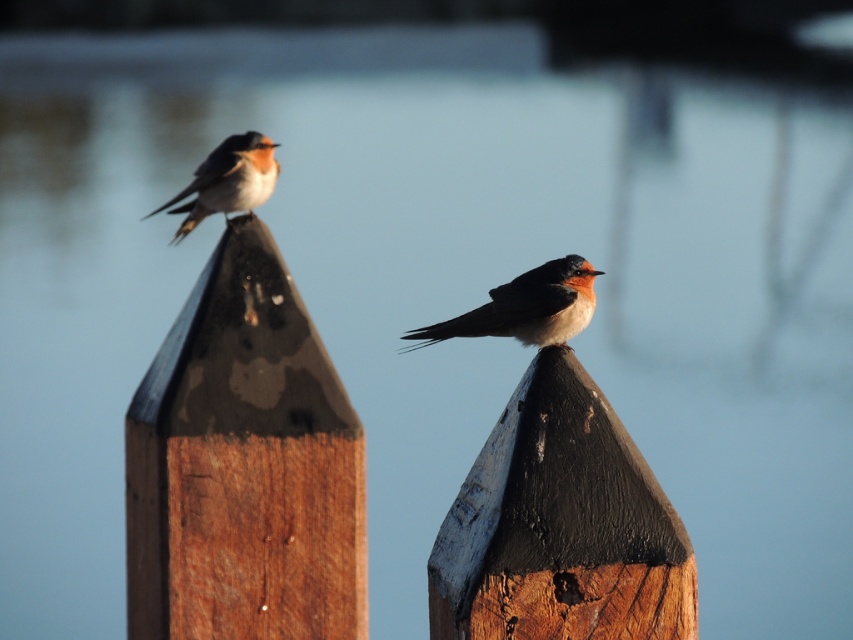
Who is more distant from viewer, (515, 285) or (202, 196)?

Positioned behind is point (202, 196).

Who is lower down, orange-brown feathers at center or bright orange plumage at upper left?

orange-brown feathers at center

What do you see at coordinates (526, 307) in the screenshot? This screenshot has width=853, height=640. I see `orange-brown feathers at center` at bounding box center [526, 307].

I want to click on orange-brown feathers at center, so click(526, 307).

Looking at this image, who is positioned more to the left, painted wood post at center or bright orange plumage at upper left?

Positioned to the left is bright orange plumage at upper left.

Which of these two, painted wood post at center or bright orange plumage at upper left, stands shorter?

bright orange plumage at upper left is shorter.

You are a GUI agent. You are given a task and a screenshot of the screen. Output one action in this format:
    pyautogui.click(x=<x>, y=<y>)
    Task: Click on the painted wood post at center
    The width and height of the screenshot is (853, 640).
    Given the screenshot: What is the action you would take?
    pyautogui.click(x=560, y=525)

Is point (347, 493) closer to camera compared to point (453, 625)?

That is False.

Who is more forward, (196, 284) or (469, 493)?

Point (469, 493) is more forward.

Image resolution: width=853 pixels, height=640 pixels. In order to click on brown wood post at upper center in this screenshot , I will do `click(244, 465)`.